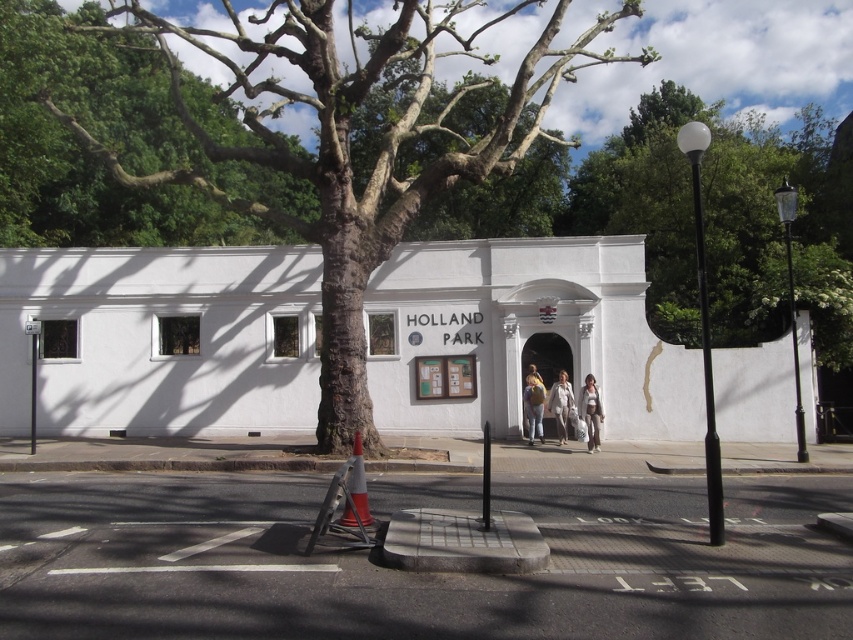
Is green leafy tree at upper left closer to the viewer compared to light beige pants at center?

No, it is not.

Does green leafy tree at upper left have a larger size compared to light beige pants at center?

Correct, green leafy tree at upper left is larger in size than light beige pants at center.

Does point (86, 212) lie in front of point (593, 381)?

No, it is behind (593, 381).

Where is `green leafy tree at upper left`? Image resolution: width=853 pixels, height=640 pixels. green leafy tree at upper left is located at coordinates (107, 145).

Which of these two, light beige coat at center or matte beige backpack at center, stands taller?

light beige coat at center is taller.

Who is more distant from viewer, (561, 404) or (537, 412)?

Positioned behind is point (537, 412).

This screenshot has width=853, height=640. I want to click on light beige coat at center, so click(x=560, y=404).

Between point (141, 77) and point (364, 476), which one is positioned in front?

Positioned in front is point (364, 476).

Between green leafy tree at upper left and orange reflective cone at lower center, which one has less height?

orange reflective cone at lower center

Is point (0, 100) closer to viewer compared to point (357, 486)?

No, it is behind (357, 486).

Locate an element on the screen. Image resolution: width=853 pixels, height=640 pixels. green leafy tree at upper left is located at coordinates (107, 145).